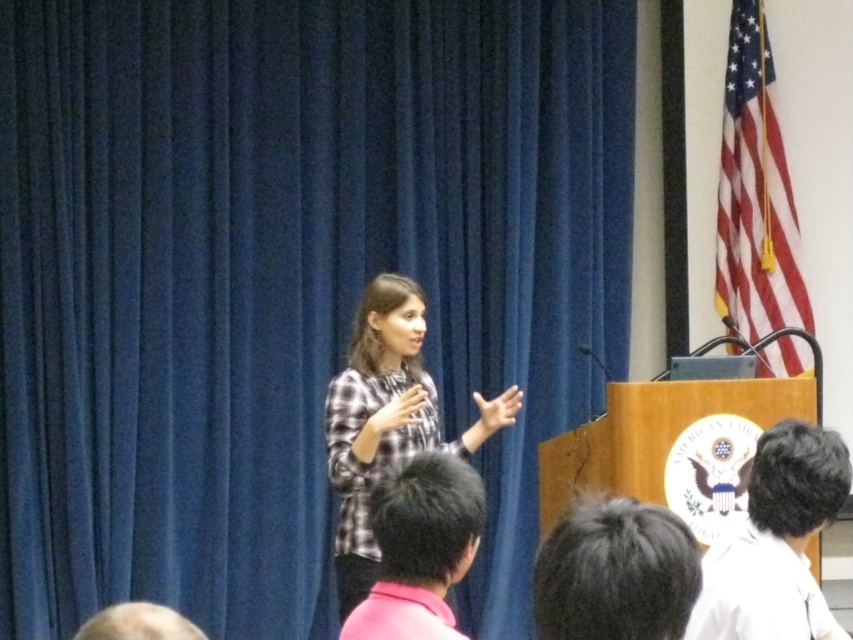
Who is taller, blue fabric curtain at center or black hair at upper right?

With more height is blue fabric curtain at center.

Where is `blue fabric curtain at center`? The height and width of the screenshot is (640, 853). blue fabric curtain at center is located at coordinates (287, 280).

This screenshot has width=853, height=640. Find the location of `blue fabric curtain at center`. blue fabric curtain at center is located at coordinates (287, 280).

Can you confirm if pink fabric head at lower center is bigger than blonde hair at lower left?

Yes, pink fabric head at lower center is bigger than blonde hair at lower left.

Which of these two, pink fabric head at lower center or blonde hair at lower left, stands taller?

Standing taller between the two is pink fabric head at lower center.

Image resolution: width=853 pixels, height=640 pixels. Find the location of `pink fabric head at lower center`. pink fabric head at lower center is located at coordinates (419, 548).

Does plaid fabric shirt at center appear under black hair at upper center?

Correct, plaid fabric shirt at center is located below black hair at upper center.

Which of these two, plaid fabric shirt at center or black hair at upper center, stands shorter?

Standing shorter between the two is black hair at upper center.

Between point (381, 436) and point (593, 500), which one is positioned in front?

Point (593, 500)

Where is `plaid fabric shirt at center`? plaid fabric shirt at center is located at coordinates (386, 420).